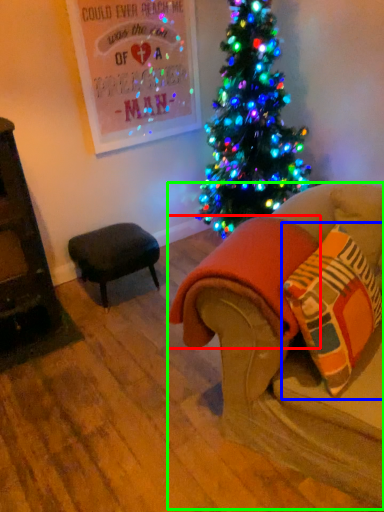
Question: Estimate the real-world distances between objects in this image. Which object is farther from blanket (highlighted by a red box), throw pillow (highlighted by a blue box) or studio couch (highlighted by a green box)?

Choices:
 (A) throw pillow
 (B) studio couch

Answer: (A)